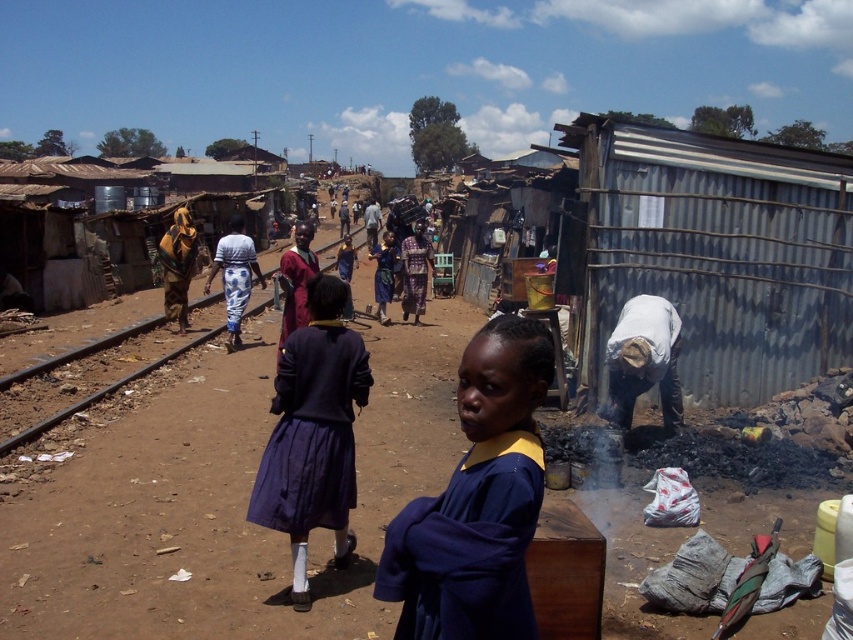
You are a tailor who needs to determine which garment has a greater width to accommodate a client with wider hips. Based on the image, which garment between the dark purple fabric skirt at center and the matte brown dress at left has a larger width?

The dark purple fabric skirt at center has a greater width than the matte brown dress at left, making it more suitable for accommodating wider hips.